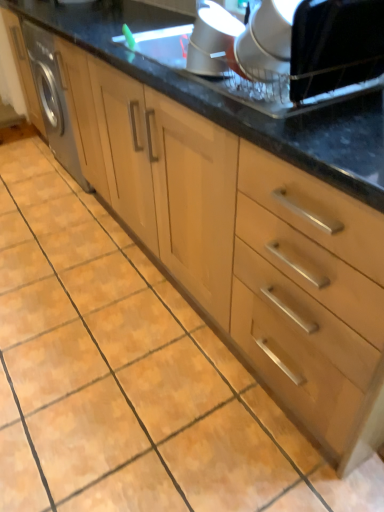
Locate an element on the screen. This screenshot has width=384, height=512. black fabric at upper right, the 2th appliance viewed from the left is located at coordinates (299, 54).

What do you see at coordinates (299, 54) in the screenshot? The image size is (384, 512). I see `black fabric at upper right, which appears as the 1th appliance when viewed from the right` at bounding box center [299, 54].

How much space does satin silver vent at upper center, which is the 1th appliance in left-to-right order, occupy horizontally?

It is 7.73 inches.

The height and width of the screenshot is (512, 384). Describe the element at coordinates (213, 41) in the screenshot. I see `satin silver vent at upper center, the second appliance from the right` at that location.

What is the approximate height of satin silver vent at upper center, which is the 1th appliance in left-to-right order?

satin silver vent at upper center, which is the 1th appliance in left-to-right order, is 6.05 inches in height.

Locate an element on the screen. This screenshot has width=384, height=512. satin silver vent at upper center, which is the 1th appliance in left-to-right order is located at coordinates (213, 41).

The width and height of the screenshot is (384, 512). In order to click on black fabric at upper right, the 2th appliance viewed from the left in this screenshot , I will do `click(299, 54)`.

Based on their positions, is black fabric at upper right, which appears as the 1th appliance when viewed from the right, located to the left or right of satin silver vent at upper center, the second appliance from the right?

Based on their positions, black fabric at upper right, which appears as the 1th appliance when viewed from the right, is located to the right of satin silver vent at upper center, the second appliance from the right.

Considering their positions, is black fabric at upper right, which appears as the 1th appliance when viewed from the right, located in front of or behind satin silver vent at upper center, which is the 1th appliance in left-to-right order?

In the image, black fabric at upper right, which appears as the 1th appliance when viewed from the right, appears in front of satin silver vent at upper center, which is the 1th appliance in left-to-right order.

Between point (314, 99) and point (198, 16), which one is positioned in front?

Point (314, 99)

From the image's perspective, relative to satin silver vent at upper center, which is the 1th appliance in left-to-right order, is black fabric at upper right, the 2th appliance viewed from the left, above or below?

black fabric at upper right, the 2th appliance viewed from the left, is below satin silver vent at upper center, which is the 1th appliance in left-to-right order.

From a real-world perspective, is black fabric at upper right, the 2th appliance viewed from the left, physically above satin silver vent at upper center, the second appliance from the right?

Yes, from a real-world perspective, black fabric at upper right, the 2th appliance viewed from the left, is on top of satin silver vent at upper center, the second appliance from the right.

Is black fabric at upper right, the 2th appliance viewed from the left, thinner than satin silver vent at upper center, which is the 1th appliance in left-to-right order?

No.

Considering the sizes of black fabric at upper right, which appears as the 1th appliance when viewed from the right, and satin silver vent at upper center, which is the 1th appliance in left-to-right order, in the image, is black fabric at upper right, which appears as the 1th appliance when viewed from the right, taller or shorter than satin silver vent at upper center, which is the 1th appliance in left-to-right order,?

Clearly, black fabric at upper right, which appears as the 1th appliance when viewed from the right, is taller compared to satin silver vent at upper center, which is the 1th appliance in left-to-right order.

Is black fabric at upper right, the 2th appliance viewed from the left, bigger than satin silver vent at upper center, which is the 1th appliance in left-to-right order?

Yes, black fabric at upper right, the 2th appliance viewed from the left, is bigger than satin silver vent at upper center, which is the 1th appliance in left-to-right order.

Is black fabric at upper right, the 2th appliance viewed from the left, outside of satin silver vent at upper center, the second appliance from the right?

black fabric at upper right, the 2th appliance viewed from the left, lies outside satin silver vent at upper center, the second appliance from the right,'s area.

Can you see black fabric at upper right, which appears as the 1th appliance when viewed from the right, touching satin silver vent at upper center, the second appliance from the right?

There is a gap between black fabric at upper right, which appears as the 1th appliance when viewed from the right, and satin silver vent at upper center, the second appliance from the right.

Could you tell me if black fabric at upper right, the 2th appliance viewed from the left, is facing satin silver vent at upper center, the second appliance from the right?

No, black fabric at upper right, the 2th appliance viewed from the left, is not oriented towards satin silver vent at upper center, the second appliance from the right.

Identify the location of appliance below the satin silver vent at upper center, which is the 1th appliance in left-to-right order (from the image's perspective). The width and height of the screenshot is (384, 512). (299, 54).

Considering the positions of objects satin silver vent at upper center, which is the 1th appliance in left-to-right order, and black fabric at upper right, which appears as the 1th appliance when viewed from the right, in the image provided, who is more to the right, satin silver vent at upper center, which is the 1th appliance in left-to-right order, or black fabric at upper right, which appears as the 1th appliance when viewed from the right,?

black fabric at upper right, which appears as the 1th appliance when viewed from the right.

Is the depth of satin silver vent at upper center, the second appliance from the right, less than that of black fabric at upper right, which appears as the 1th appliance when viewed from the right?

No, satin silver vent at upper center, the second appliance from the right, is further to the viewer.

Which is closer, (208, 26) or (262, 19)?

The point (262, 19) is more forward.

From the image's perspective, who appears lower, satin silver vent at upper center, the second appliance from the right, or black fabric at upper right, the 2th appliance viewed from the left?

black fabric at upper right, the 2th appliance viewed from the left, appears lower in the image.

From a real-world perspective, relative to black fabric at upper right, which appears as the 1th appliance when viewed from the right, is satin silver vent at upper center, which is the 1th appliance in left-to-right order, vertically above or below?

Clearly, from a real-world perspective, satin silver vent at upper center, which is the 1th appliance in left-to-right order, is below black fabric at upper right, which appears as the 1th appliance when viewed from the right.

Between satin silver vent at upper center, the second appliance from the right, and black fabric at upper right, the 2th appliance viewed from the left, which one has larger width?

With larger width is black fabric at upper right, the 2th appliance viewed from the left.

Is satin silver vent at upper center, which is the 1th appliance in left-to-right order, taller or shorter than black fabric at upper right, which appears as the 1th appliance when viewed from the right?

Clearly, satin silver vent at upper center, which is the 1th appliance in left-to-right order, is shorter compared to black fabric at upper right, which appears as the 1th appliance when viewed from the right.

Considering the sizes of satin silver vent at upper center, the second appliance from the right, and black fabric at upper right, which appears as the 1th appliance when viewed from the right, in the image, is satin silver vent at upper center, the second appliance from the right, bigger or smaller than black fabric at upper right, which appears as the 1th appliance when viewed from the right,?

Considering their sizes, satin silver vent at upper center, the second appliance from the right, takes up less space than black fabric at upper right, which appears as the 1th appliance when viewed from the right.

Is black fabric at upper right, which appears as the 1th appliance when viewed from the right, a part of satin silver vent at upper center, the second appliance from the right?

No, satin silver vent at upper center, the second appliance from the right, does not contain black fabric at upper right, which appears as the 1th appliance when viewed from the right.

Is satin silver vent at upper center, the second appliance from the right, positioned far away from black fabric at upper right, which appears as the 1th appliance when viewed from the right?

No, there isn't a large distance between satin silver vent at upper center, the second appliance from the right, and black fabric at upper right, which appears as the 1th appliance when viewed from the right.

Is black fabric at upper right, which appears as the 1th appliance when viewed from the right, at the back of satin silver vent at upper center, the second appliance from the right?

No, satin silver vent at upper center, the second appliance from the right, is not facing the opposite direction of black fabric at upper right, which appears as the 1th appliance when viewed from the right.

In the scene shown: Can you tell me how much satin silver vent at upper center, which is the 1th appliance in left-to-right order, and black fabric at upper right, the 2th appliance viewed from the left, differ in facing direction?

The facing directions of satin silver vent at upper center, which is the 1th appliance in left-to-right order, and black fabric at upper right, the 2th appliance viewed from the left, are 3.21 degrees apart.

Measure the distance between satin silver vent at upper center, the second appliance from the right, and black fabric at upper right, which appears as the 1th appliance when viewed from the right.

satin silver vent at upper center, the second appliance from the right, and black fabric at upper right, which appears as the 1th appliance when viewed from the right, are 6.83 inches apart.

In order to click on appliance on the left of black fabric at upper right, which appears as the 1th appliance when viewed from the right in this screenshot , I will do `click(213, 41)`.

You are a GUI agent. You are given a task and a screenshot of the screen. Output one action in this format:
    pyautogui.click(x=<x>, y=<y>)
    Task: Click on the appliance lying below the satin silver vent at upper center, the second appliance from the right (from the image's perspective)
    The width and height of the screenshot is (384, 512).
    Given the screenshot: What is the action you would take?
    pyautogui.click(x=299, y=54)

Locate an element on the screen. appliance on the right of satin silver vent at upper center, the second appliance from the right is located at coordinates [299, 54].